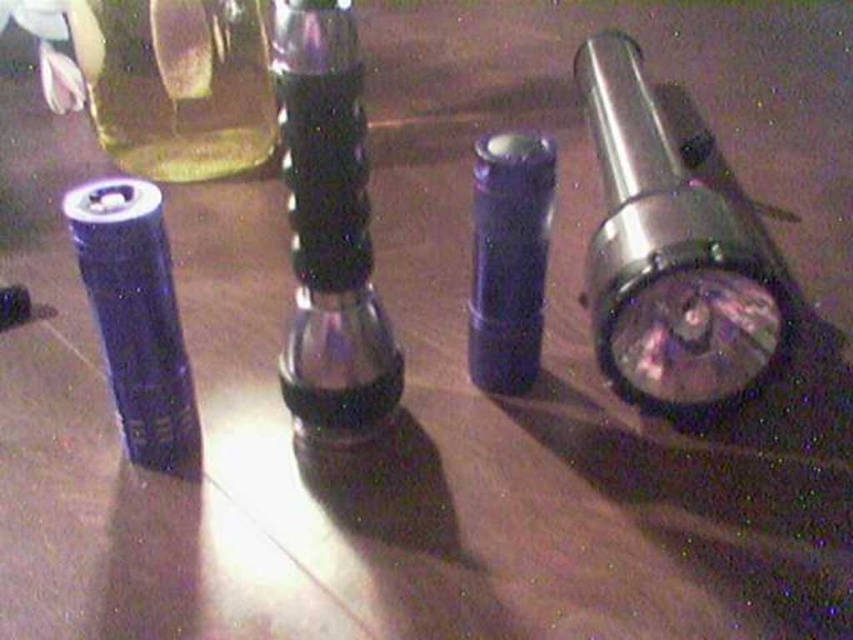
Is point (606, 220) behind point (97, 125)?

That is False.

Is point (653, 180) closer to camera compared to point (102, 129)?

That is True.

Locate an element on the screen. metallic silver flashlight at right is located at coordinates (670, 257).

Does metallic silver flashlight at right have a greater width compared to matte purple lipstick at center?

Correct, the width of metallic silver flashlight at right exceeds that of matte purple lipstick at center.

Does metallic silver flashlight at right have a lesser height compared to matte purple lipstick at center?

Incorrect, metallic silver flashlight at right's height does not fall short of matte purple lipstick at center's.

This screenshot has width=853, height=640. What do you see at coordinates (670, 257) in the screenshot?
I see `metallic silver flashlight at right` at bounding box center [670, 257].

Identify the location of metallic silver flashlight at right. (670, 257).

Is transparent plastic bottle at center taller than matte purple lipstick at center?

Yes.

Can you confirm if transparent plastic bottle at center is positioned to the right of matte purple lipstick at center?

In fact, transparent plastic bottle at center is to the left of matte purple lipstick at center.

Does point (292, 337) lie behind point (503, 349)?

No, it is not.

Find the location of a particular element. transparent plastic bottle at center is located at coordinates (329, 227).